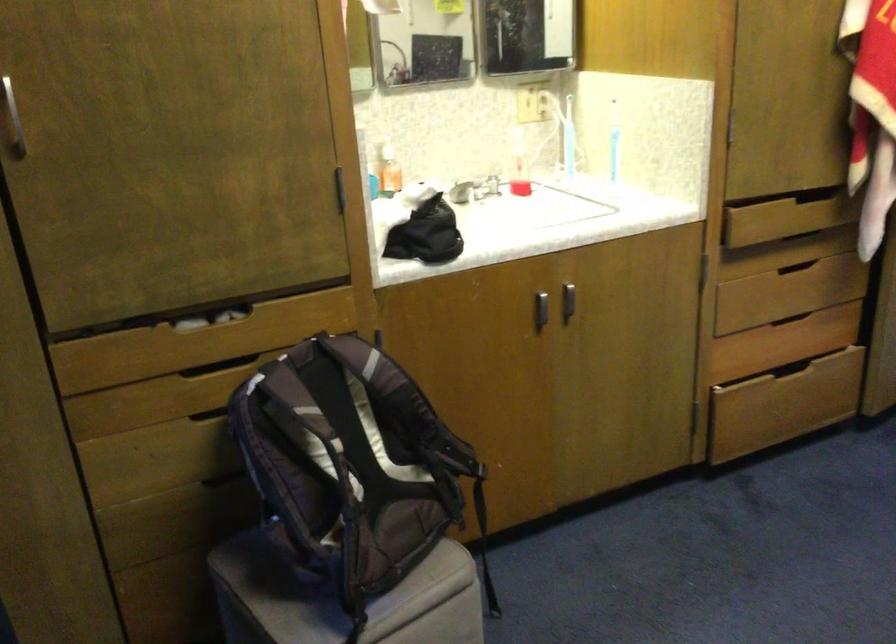
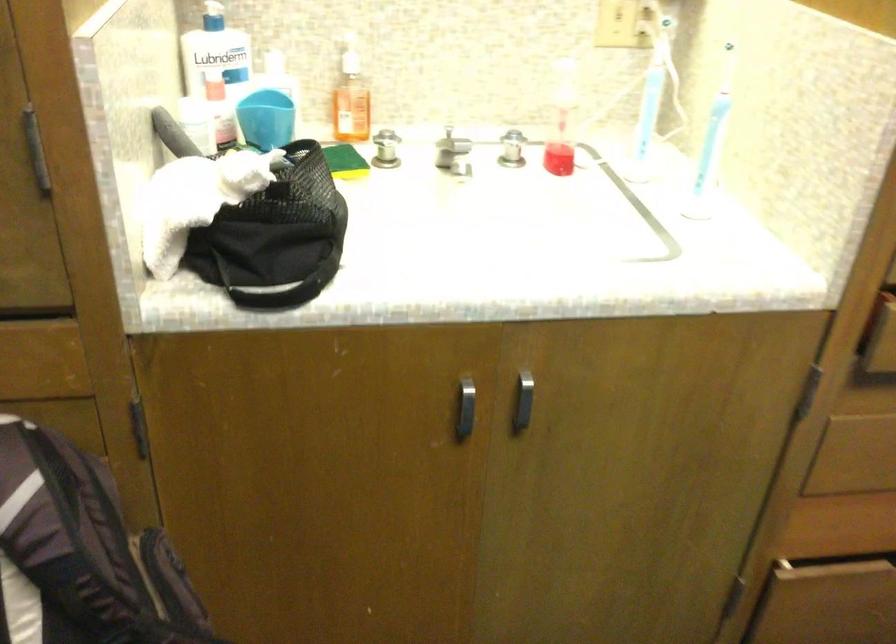
Find the pixel in the second image that matches point 385,149 in the first image.

(349, 59)